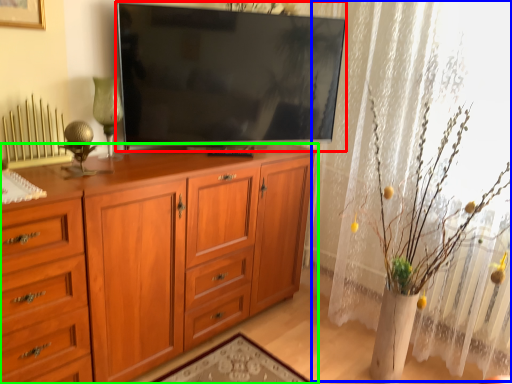
Question: Based on their relative distances, which object is nearer to television (highlighted by a red box)? Choose from curtain (highlighted by a blue box) and cabinetry (highlighted by a green box).

Choices:
 (A) curtain
 (B) cabinetry

Answer: (B)